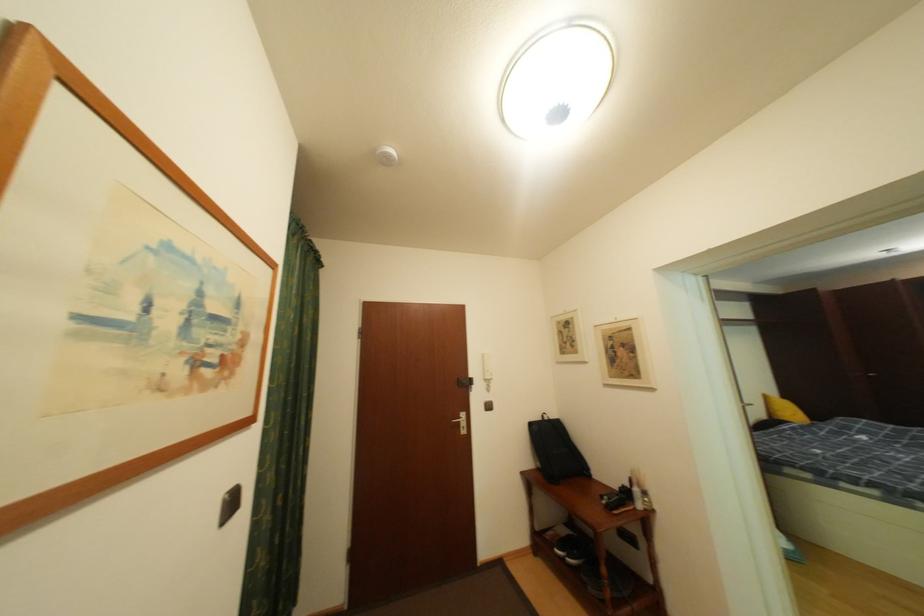
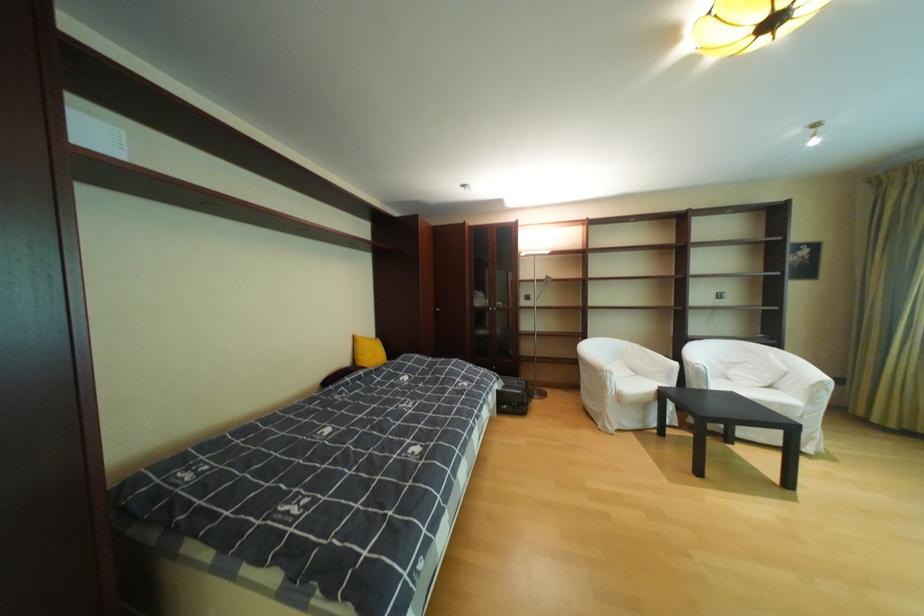
Find the pixel in the second image that matches (776,398) in the first image.

(367, 339)